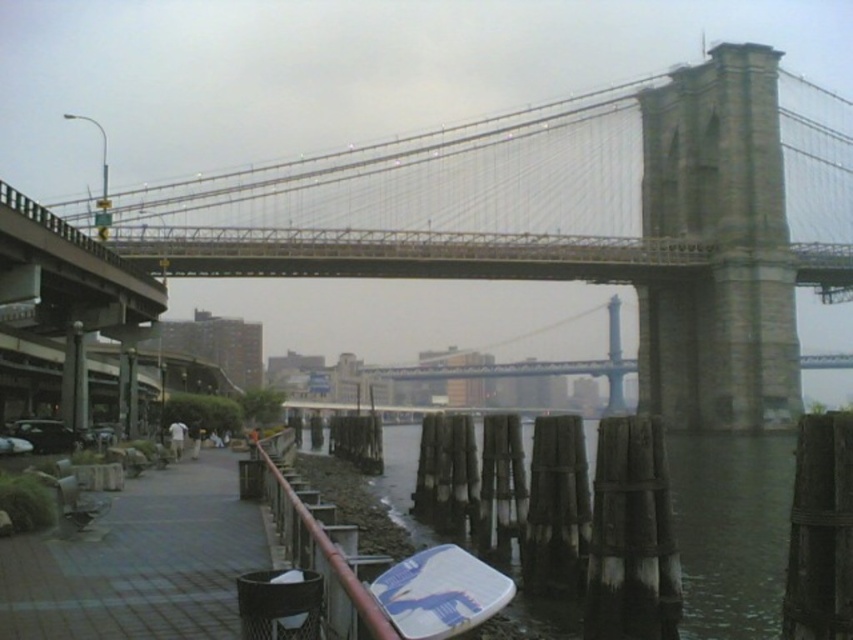
You are standing on the waterfront walkway and want to take a photo of the stone gray suspension bridge at center. However, there are brown wooden posts at lower center in the way. Can you see the bridge clearly through the posts?

The stone gray suspension bridge at center is further to the viewer than the brown wooden posts at lower center, so the posts are closer to you and block your view of the bridge.

You are standing on the walkway near the water and want to reach the point labeled point (743, 104). Which direction should you move relative to point (721, 538)?

You should move behind point (721, 538) to reach point (743, 104) because point (743, 104) is located behind point (721, 538).